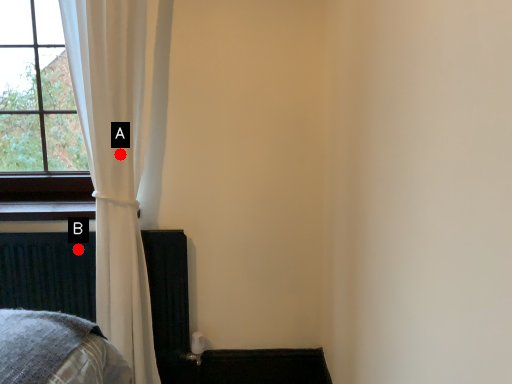
Question: Two points are circled on the image, labeled by A and B beside each circle. Which point is closer to the camera?

Choices:
 (A) A is closer
 (B) B is closer

Answer: (A)